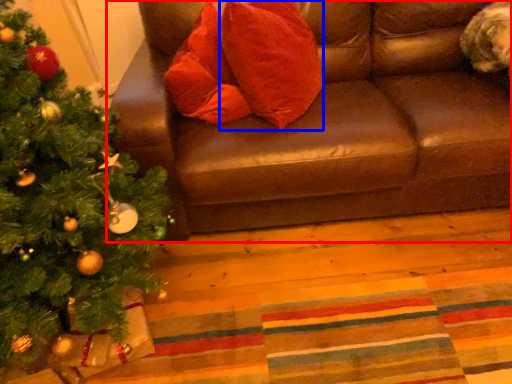
Question: Which point is closer to the camera, studio couch (highlighted by a red box) or throw pillow (highlighted by a blue box)?

Choices:
 (A) studio couch
 (B) throw pillow

Answer: (A)